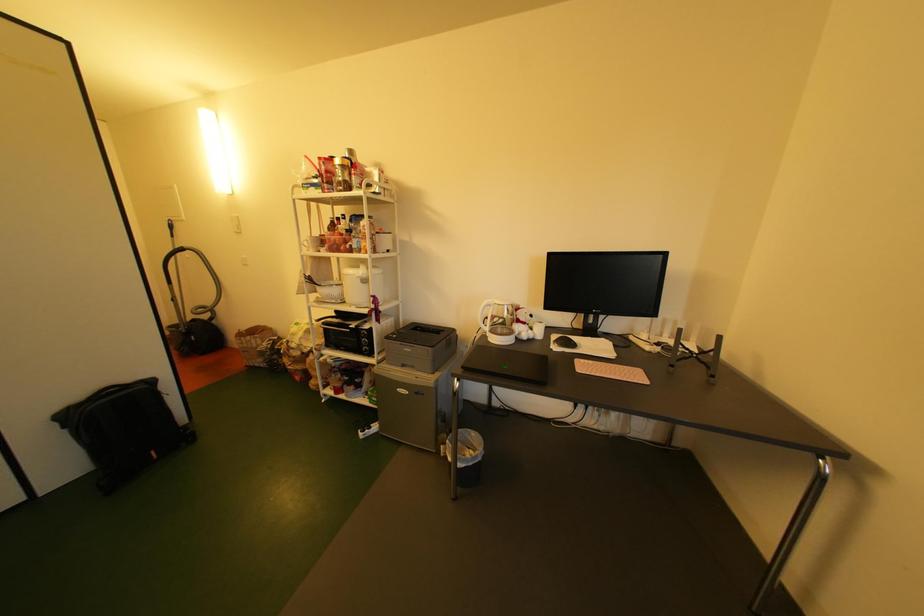
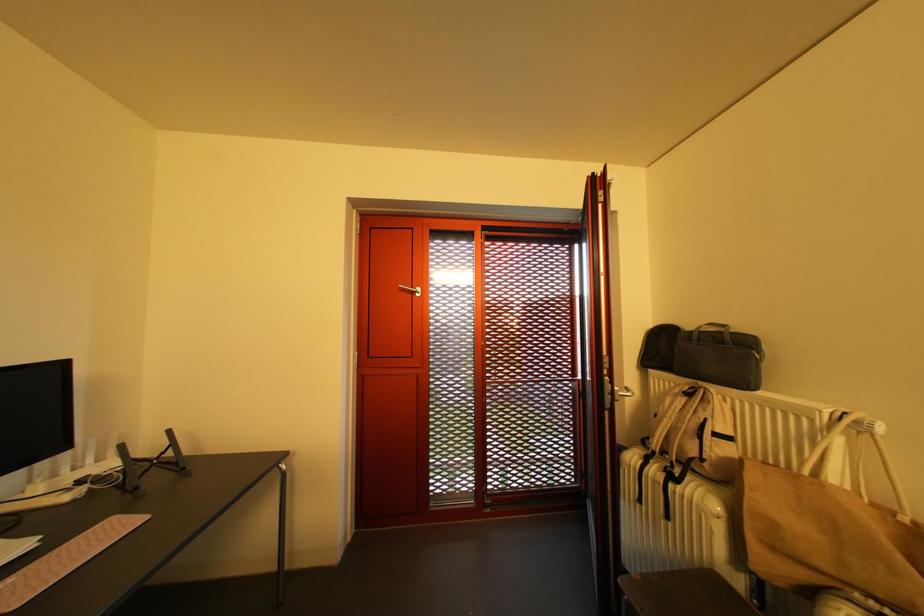
Question: The camera is either moving clockwise (left) or counter-clockwise (right) around the object. The first image is from the beginning of the video and the second image is from the end. Is the camera moving left or right when shooting the video?

Choices:
 (A) Left
 (B) Right

Answer: (A)